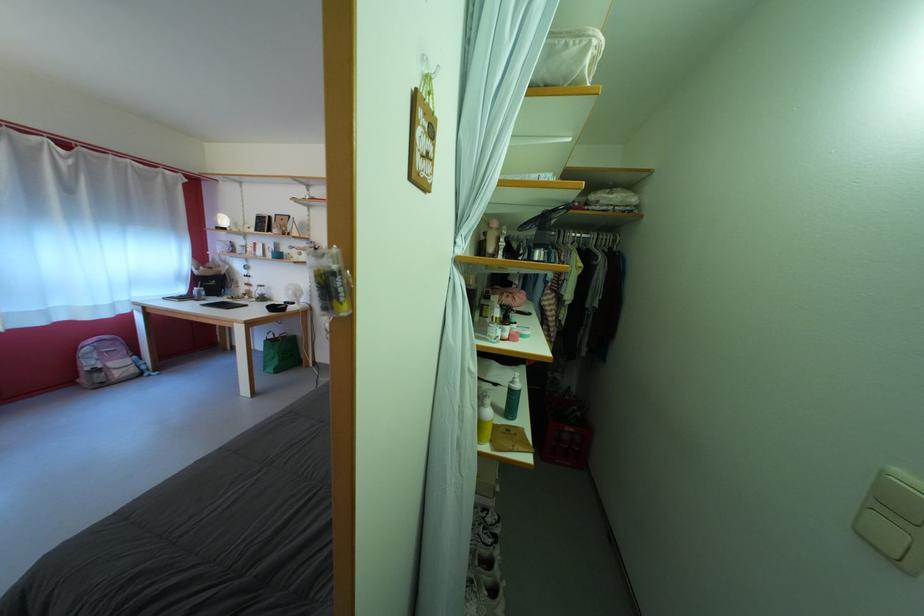
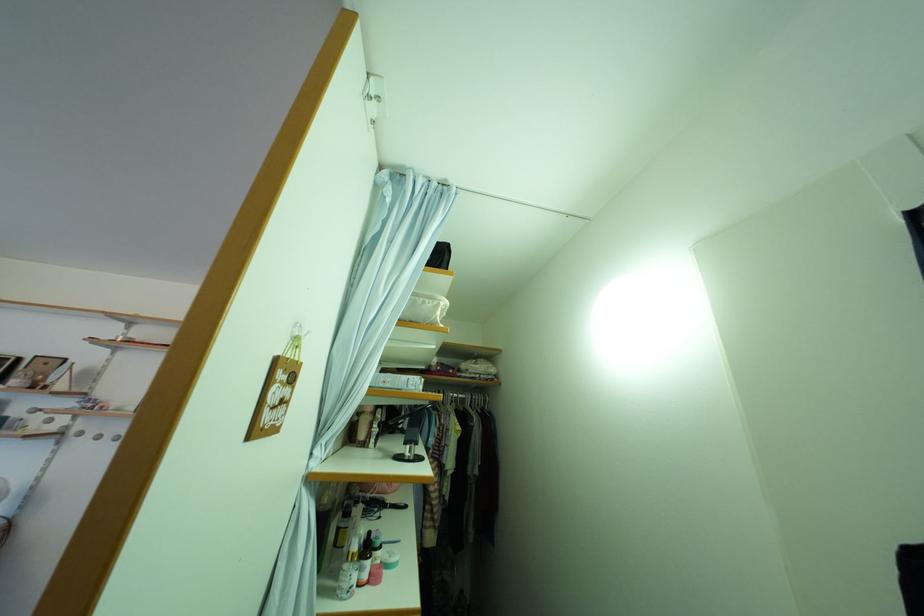
In the second image, find the point that corresponds to point (524, 329) in the first image.

(390, 554)